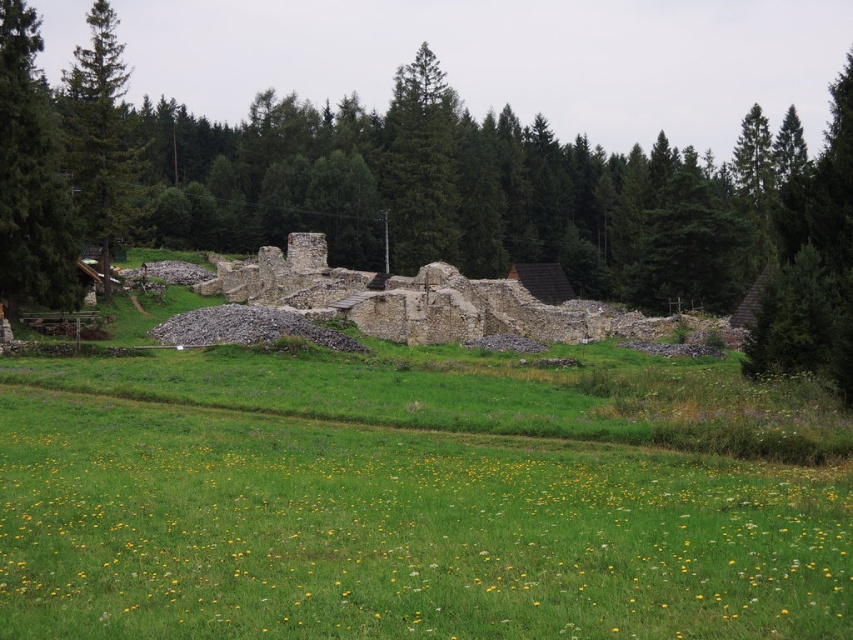
You are a hiker trying to determine the tallest tree between the green textured tree at left and the green textured tree at center. Based on the scene, which tree is taller?

The green textured tree at center is taller than the green textured tree at left.

You are standing in the middle of the grassy field with yellow flowers. You want to walk towards the green leafy forest at center. Which direction should you head?

The green leafy forest at center is located at point coordinates of 0.317 on the x axis and 0.620 on the y axis. Since the forest is at the center, you should head towards the central area of the image to reach it.